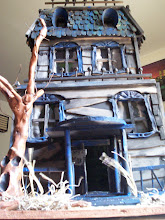
Where is `plant`? Image resolution: width=165 pixels, height=220 pixels. plant is located at coordinates (157, 81).